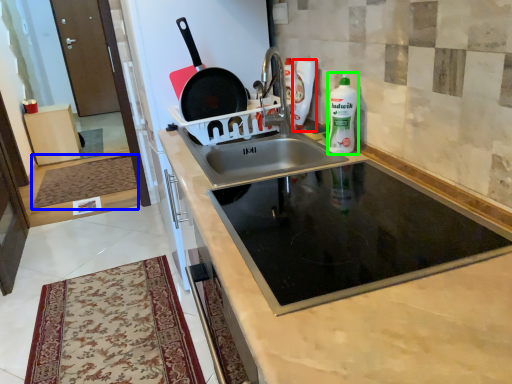
Question: Which is farther away from cleaning product (highlighted by a red box)? mat (highlighted by a blue box) or bottle (highlighted by a green box)?

Choices:
 (A) mat
 (B) bottle

Answer: (A)